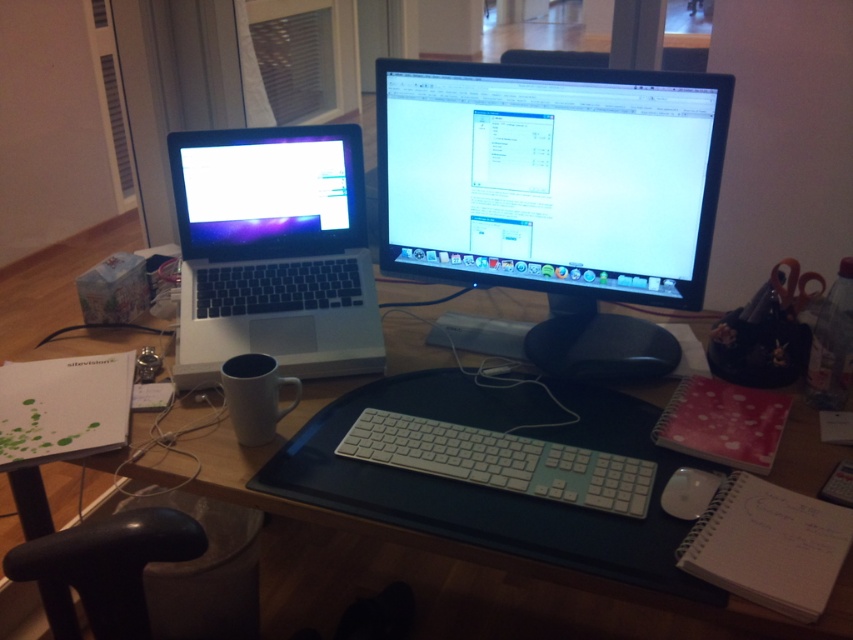
You are organizing the desk and need to place a new monitor stand that requires 10 cm of clearance height. The stand must be placed either on the wooden desk at center or on the matte black laptop at left. Based on their heights, which surface can accommodate the stand?

The wooden desk at center is much taller than the matte black laptop at left, so the stand should be placed on the wooden desk at center to ensure there is enough clearance height for the monitor stand.

From the picture: You are organizing your desk and want to place the white matte coffee cup at lower left and the white plastic mouse at lower right. If you need to move the mouse closer to the keyboard, which object should you move first?

The white plastic mouse at lower right should be moved first because the white matte coffee cup at lower left is above it, meaning the mouse is lower and closer to the keyboard area.

You are organizing a desk and want to place a new monitor that is 18 inches tall. The current setup has the satin black monitor at center and the wooden desk at center. Can the new monitor fit vertically on the desk without exceeding the desk height?

The satin black monitor at center is shorter than the wooden desk at center, so the new monitor that is 18 inches tall can fit vertically on the desk as long as its height does not exceed the desk height. However, since the desk height is not specified, it is recommended to measure the desk height before placing the monitor.